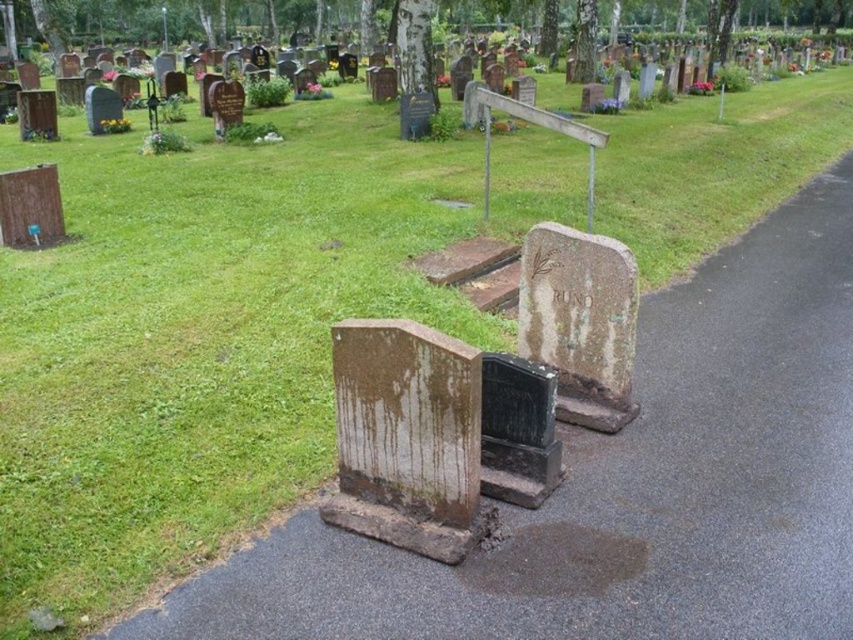
Can you confirm if brown stone gravestone at center is shorter than bronze textured gravestone at center?

Correct, brown stone gravestone at center is not as tall as bronze textured gravestone at center.

Which is behind, point (476, 429) or point (599, 330)?

Point (599, 330)

Image resolution: width=853 pixels, height=640 pixels. I want to click on brown stone gravestone at center, so click(x=405, y=436).

Can you confirm if bronze textured gravestone at center is thinner than black stone gravestone at center?

No.

In the scene shown: Who is taller, bronze textured gravestone at center or black stone gravestone at center?

Standing taller between the two is bronze textured gravestone at center.

Between point (601, 396) and point (527, 504), which one is positioned behind?

Positioned behind is point (601, 396).

Find the location of a particular element. bronze textured gravestone at center is located at coordinates (579, 321).

This screenshot has width=853, height=640. Describe the element at coordinates (405, 436) in the screenshot. I see `brown stone gravestone at center` at that location.

Is brown stone gravestone at center positioned behind black stone gravestone at center?

No, brown stone gravestone at center is closer to the viewer.

Is point (418, 406) closer to viewer compared to point (503, 422)?

That is True.

At what (x,y) coordinates should I click in order to perform the action: click on brown stone gravestone at center. Please return your answer as a coordinate pair (x, y). Image resolution: width=853 pixels, height=640 pixels. Looking at the image, I should click on (405, 436).